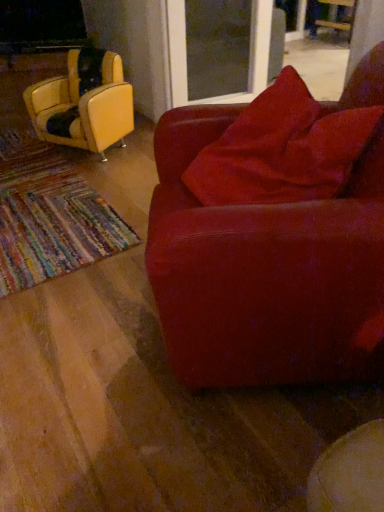
Describe the element at coordinates (83, 104) in the screenshot. I see `leather yellow chair at left, acting as the second chair starting from the bottom` at that location.

Describe the element at coordinates (265, 272) in the screenshot. This screenshot has width=384, height=512. I see `suede-like red couch at center, placed as the 1th chair when sorted from bottom to top` at that location.

What do you see at coordinates (248, 60) in the screenshot? I see `transparent glass screen door at upper center` at bounding box center [248, 60].

You are a GUI agent. You are given a task and a screenshot of the screen. Output one action in this format:
    pyautogui.click(x=<x>, y=<y>)
    Task: Click on the leather yellow chair at left, which is the second chair in front-to-back order
    This screenshot has height=512, width=384.
    Given the screenshot: What is the action you would take?
    pyautogui.click(x=83, y=104)

Which of these two, transparent glass screen door at upper center or leather yellow chair at left, acting as the second chair starting from the bottom, is thinner?

leather yellow chair at left, acting as the second chair starting from the bottom.

Locate an element on the screen. screen door above the leather yellow chair at left, arranged as the third chair when viewed from the right (from a real-world perspective) is located at coordinates (248, 60).

From a real-world perspective, who is located lower, transparent glass screen door at upper center or leather yellow chair at left, acting as the second chair starting from the bottom?

In real-world perspective, leather yellow chair at left, acting as the second chair starting from the bottom, is lower.

Would you say leather yellow chair at left, acting as the second chair starting from the bottom, is to the left or to the right of transparent glass screen door at upper center in the picture?

leather yellow chair at left, acting as the second chair starting from the bottom, is positioned on transparent glass screen door at upper center's left side.

Can you confirm if leather yellow chair at left, placed as the 2th chair when sorted from back to front, is taller than transparent glass screen door at upper center?

No.

Find the location of a particular element. The width and height of the screenshot is (384, 512). chair that is the 1st one when counting forward from the transparent glass screen door at upper center is located at coordinates (83, 104).

Is wooden chair at upper right, acting as the 3th chair starting from the left, not near transparent glass screen door at upper center?

wooden chair at upper right, acting as the 3th chair starting from the left, is positioned a significant distance from transparent glass screen door at upper center.

Is point (337, 25) closer or farther from the camera than point (186, 83)?

Point (337, 25) is farther from the camera than point (186, 83).

Looking at this image, in the image, is wooden chair at upper right, the first chair from the back, on the left side or the right side of transparent glass screen door at upper center?

From the image, it's evident that wooden chair at upper right, the first chair from the back, is to the right of transparent glass screen door at upper center.

Is suede-like red couch at center, placed as the 1th chair when sorted from bottom to top, outside of leather yellow chair at left, the 2th chair positioned from the top?

Absolutely, suede-like red couch at center, placed as the 1th chair when sorted from bottom to top, is external to leather yellow chair at left, the 2th chair positioned from the top.

Is the position of suede-like red couch at center, placed as the 1th chair when sorted from bottom to top, more distant than that of leather yellow chair at left, acting as the second chair starting from the bottom?

No, it is in front of leather yellow chair at left, acting as the second chair starting from the bottom.

From a real-world perspective, is suede-like red couch at center, placed as the 1th chair when sorted from bottom to top, physically below leather yellow chair at left, the 2th chair positioned from the top?

Actually, suede-like red couch at center, placed as the 1th chair when sorted from bottom to top, is physically above leather yellow chair at left, the 2th chair positioned from the top, in the real world.

Identify the location of chair above the leather yellow chair at left, placed as the 2th chair when sorted from back to front (from a real-world perspective). This screenshot has height=512, width=384. (265, 272).

From a real-world perspective, which is physically above, leather yellow chair at left, the 2th chair positioned from the top, or wooden chair at upper right, acting as the 3th chair starting from the front?

In real-world perspective, leather yellow chair at left, the 2th chair positioned from the top, is above.

The width and height of the screenshot is (384, 512). Identify the location of the 2nd chair counting from the right of the leather yellow chair at left, the 1th chair viewed from the left. (336, 18).

Can you confirm if leather yellow chair at left, placed as the 2th chair when sorted from back to front, is bigger than wooden chair at upper right, the first chair from the back?

Incorrect, leather yellow chair at left, placed as the 2th chair when sorted from back to front, is not larger than wooden chair at upper right, the first chair from the back.

Would you say transparent glass screen door at upper center contains suede-like red couch at center, positioned as the second chair in right-to-left order?

No, suede-like red couch at center, positioned as the second chair in right-to-left order, is not surrounded by transparent glass screen door at upper center.

Is transparent glass screen door at upper center aimed at suede-like red couch at center, marked as the 3th chair in a top-to-bottom arrangement?

No, transparent glass screen door at upper center is not oriented towards suede-like red couch at center, marked as the 3th chair in a top-to-bottom arrangement.

From the image's perspective, which one is positioned lower, transparent glass screen door at upper center or suede-like red couch at center, positioned as the second chair in right-to-left order?

suede-like red couch at center, positioned as the second chair in right-to-left order, appears lower in the image.

Is transparent glass screen door at upper center taller than wooden chair at upper right, the first chair from the top?

Yes, transparent glass screen door at upper center is taller than wooden chair at upper right, the first chair from the top.

How far apart are transparent glass screen door at upper center and wooden chair at upper right, the first chair from the top?

transparent glass screen door at upper center and wooden chair at upper right, the first chair from the top, are 7.53 feet apart from each other.

Does point (249, 64) appear closer or farther from the camera than point (311, 34)?

Point (249, 64) is positioned closer to the camera compared to point (311, 34).

Which chair is the 2nd one when counting from the left side of the transparent glass screen door at upper center? Please provide its 2D coordinates.

[(83, 104)]

From a real-world perspective, count 1st chairs downward from the transparent glass screen door at upper center and point to it. Please provide its 2D coordinates.

[(83, 104)]

From the image, which object appears to be farther from wooden chair at upper right, acting as the 3th chair starting from the left, leather yellow chair at left, the 1th chair viewed from the left, or suede-like red couch at center, positioned as the second chair in right-to-left order?

Among the two, suede-like red couch at center, positioned as the second chair in right-to-left order, is located further to wooden chair at upper right, acting as the 3th chair starting from the left.

Which object lies nearer to the anchor point transparent glass screen door at upper center, suede-like red couch at center, positioned as the second chair in right-to-left order, or leather yellow chair at left, the 2th chair positioned from the top?

Based on the image, leather yellow chair at left, the 2th chair positioned from the top, appears to be nearer to transparent glass screen door at upper center.

Based on their spatial positions, is transparent glass screen door at upper center or leather yellow chair at left, the 1th chair viewed from the left, further from suede-like red couch at center, which is the 3th chair in back-to-front order?

Among the two, transparent glass screen door at upper center is located further to suede-like red couch at center, which is the 3th chair in back-to-front order.

When comparing their distances from leather yellow chair at left, arranged as the third chair when viewed from the right, does transparent glass screen door at upper center or wooden chair at upper right, which ranks as the first chair in right-to-left order, seem further?

Based on the image, wooden chair at upper right, which ranks as the first chair in right-to-left order, appears to be further to leather yellow chair at left, arranged as the third chair when viewed from the right.

When comparing their distances from suede-like red couch at center, marked as the 3th chair in a top-to-bottom arrangement, does leather yellow chair at left, which is the second chair in front-to-back order, or transparent glass screen door at upper center seem closer?

Based on the image, leather yellow chair at left, which is the second chair in front-to-back order, appears to be nearer to suede-like red couch at center, marked as the 3th chair in a top-to-bottom arrangement.

Looking at the image, which one is located closer to suede-like red couch at center, placed as the 1th chair when sorted from bottom to top, wooden chair at upper right, positioned as the third chair in bottom-to-top order, or leather yellow chair at left, placed as the 2th chair when sorted from back to front?

leather yellow chair at left, placed as the 2th chair when sorted from back to front, is closer to suede-like red couch at center, placed as the 1th chair when sorted from bottom to top.

Estimate the real-world distances between objects in this image. Which object is closer to leather yellow chair at left, the 1th chair viewed from the left, wooden chair at upper right, positioned as the third chair in bottom-to-top order, or transparent glass screen door at upper center?

transparent glass screen door at upper center is positioned closer to the anchor leather yellow chair at left, the 1th chair viewed from the left.

Based on their spatial positions, is leather yellow chair at left, the 2th chair positioned from the top, or suede-like red couch at center, marked as the 1th chair in a front-to-back arrangement, further from transparent glass screen door at upper center?

suede-like red couch at center, marked as the 1th chair in a front-to-back arrangement, is positioned further to the anchor transparent glass screen door at upper center.

Image resolution: width=384 pixels, height=512 pixels. In order to click on chair positioned between suede-like red couch at center, which ranks as the second chair in left-to-right order, and transparent glass screen door at upper center from near to far in this screenshot , I will do `click(83, 104)`.

You are a GUI agent. You are given a task and a screenshot of the screen. Output one action in this format:
    pyautogui.click(x=<x>, y=<y>)
    Task: Click on the chair between suede-like red couch at center, positioned as the second chair in right-to-left order, and wooden chair at upper right, the first chair from the top, from front to back
    The image size is (384, 512).
    Given the screenshot: What is the action you would take?
    pyautogui.click(x=83, y=104)

What are the coordinates of `screen door positioned between suede-like red couch at center, marked as the 3th chair in a top-to-bottom arrangement, and wooden chair at upper right, positioned as the third chair in bottom-to-top order, from near to far` in the screenshot? It's located at (248, 60).

The image size is (384, 512). Find the location of `screen door between leather yellow chair at left, the 1th chair viewed from the left, and wooden chair at upper right, positioned as the third chair in bottom-to-top order`. screen door between leather yellow chair at left, the 1th chair viewed from the left, and wooden chair at upper right, positioned as the third chair in bottom-to-top order is located at coordinates (248, 60).